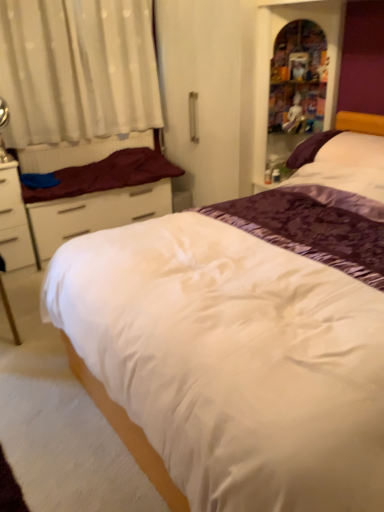
Question: Is wooden bookshelf at upper right turned away from white sheer curtain at upper left?

Choices:
 (A) no
 (B) yes

Answer: (A)

Question: Is wooden bookshelf at upper right smaller than white sheer curtain at upper left?

Choices:
 (A) yes
 (B) no

Answer: (A)

Question: From a real-world perspective, is wooden bookshelf at upper right on top of white sheer curtain at upper left?

Choices:
 (A) no
 (B) yes

Answer: (A)

Question: Is wooden bookshelf at upper right with white sheer curtain at upper left?

Choices:
 (A) yes
 (B) no

Answer: (B)

Question: Does wooden bookshelf at upper right have a lesser width compared to white sheer curtain at upper left?

Choices:
 (A) yes
 (B) no

Answer: (B)

Question: Is wooden bookshelf at upper right taller than white sheer curtain at upper left?

Choices:
 (A) yes
 (B) no

Answer: (A)

Question: Is white sheer curtain at upper left to the right of purple satin pillow at upper right from the viewer's perspective?

Choices:
 (A) no
 (B) yes

Answer: (A)

Question: Is white sheer curtain at upper left to the left of purple satin pillow at upper right from the viewer's perspective?

Choices:
 (A) yes
 (B) no

Answer: (A)

Question: Would you say white sheer curtain at upper left is outside purple satin pillow at upper right?

Choices:
 (A) yes
 (B) no

Answer: (A)

Question: Can you confirm if white sheer curtain at upper left is shorter than purple satin pillow at upper right?

Choices:
 (A) yes
 (B) no

Answer: (B)

Question: Can purple satin pillow at upper right be found inside white sheer curtain at upper left?

Choices:
 (A) yes
 (B) no

Answer: (B)

Question: Considering the relative sizes of white sheer curtain at upper left and purple satin pillow at upper right in the image provided, is white sheer curtain at upper left taller than purple satin pillow at upper right?

Choices:
 (A) yes
 (B) no

Answer: (A)

Question: Considering the relative positions of white matte drawer at left and maroon fabric mattress at left in the image provided, is white matte drawer at left to the right of maroon fabric mattress at left from the viewer's perspective?

Choices:
 (A) no
 (B) yes

Answer: (A)